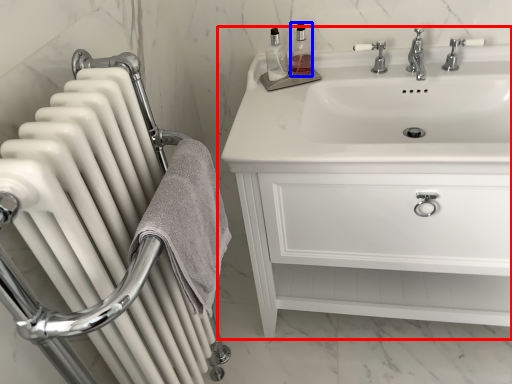
Question: Among these objects, which one is farthest to the camera, bathroom cabinet (highlighted by a red box) or soap dispenser (highlighted by a blue box)?

Choices:
 (A) bathroom cabinet
 (B) soap dispenser

Answer: (B)